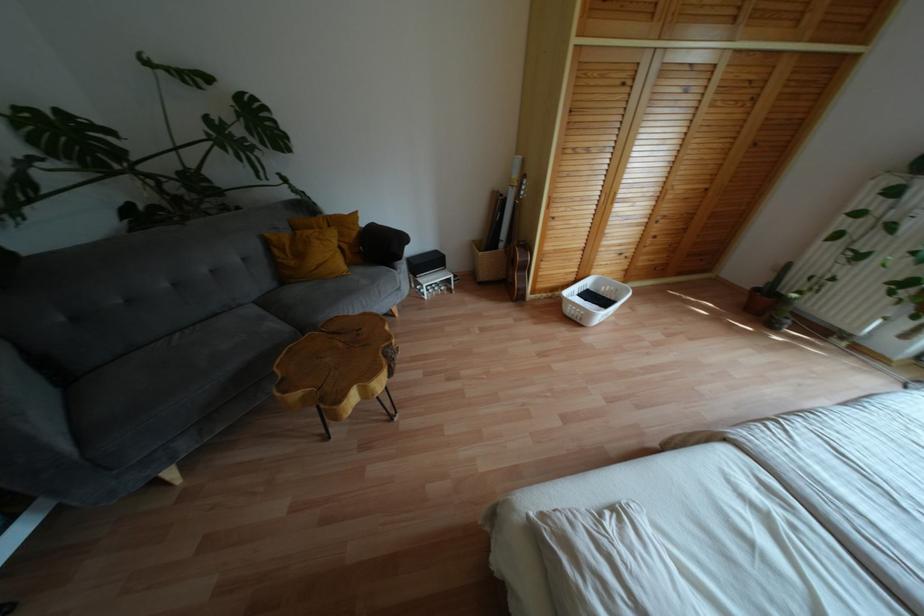
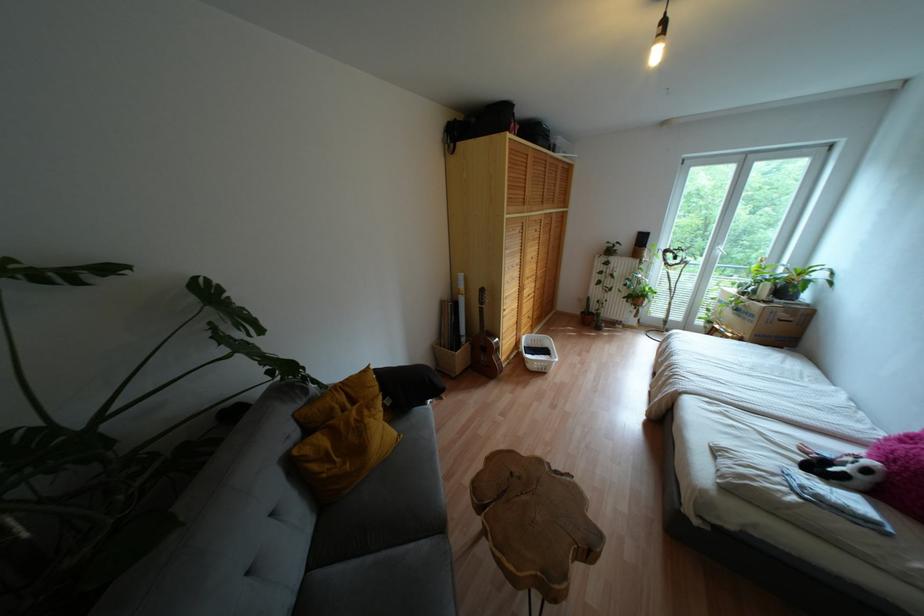
Where in the second image is the point corresponding to point (283, 249) from the first image?

(325, 458)